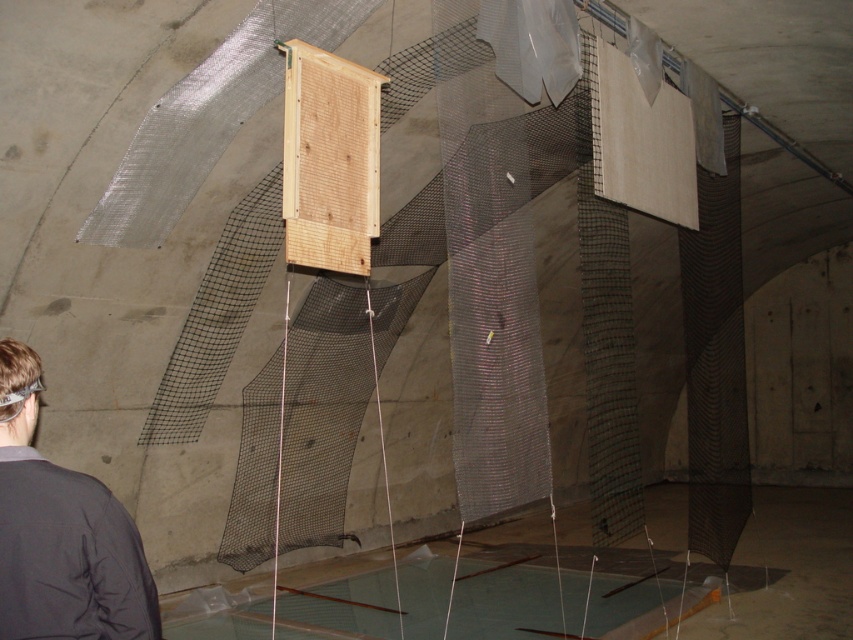
Question: Does dark gray jacket at lower left have a lesser width compared to clear plastic goggles at lower left?

Choices:
 (A) no
 (B) yes

Answer: (A)

Question: Which point is farther to the camera?

Choices:
 (A) dark gray jacket at lower left
 (B) clear plastic goggles at lower left

Answer: (B)

Question: Is dark gray jacket at lower left closer to the viewer compared to clear plastic goggles at lower left?

Choices:
 (A) yes
 (B) no

Answer: (A)

Question: Is dark gray jacket at lower left positioned at the back of clear plastic goggles at lower left?

Choices:
 (A) no
 (B) yes

Answer: (A)